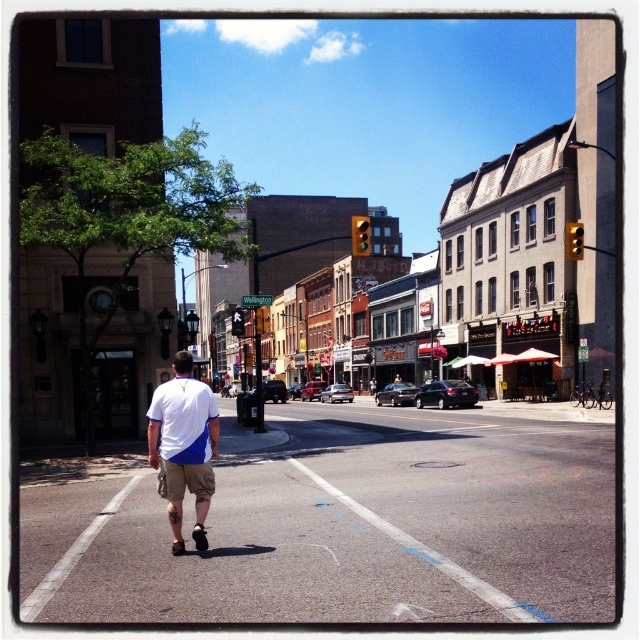
You are a pedestrian standing at the intersection and want to cross the street. You see the yellow plastic traffic light at upper right and the yellow glass traffic light at center. Which traffic light is closer to you?

The yellow plastic traffic light at upper right is closer to you since it is further to the viewer than the yellow glass traffic light at center.

You are a pedestrian standing in the middle of Wellington Street. You notice the khaki shorts at center and the yellow plastic traffic light at upper right. Which object is shorter in height?

The khaki shorts at center has a lesser height compared to the yellow plastic traffic light at upper right, so the khaki shorts at center is shorter.